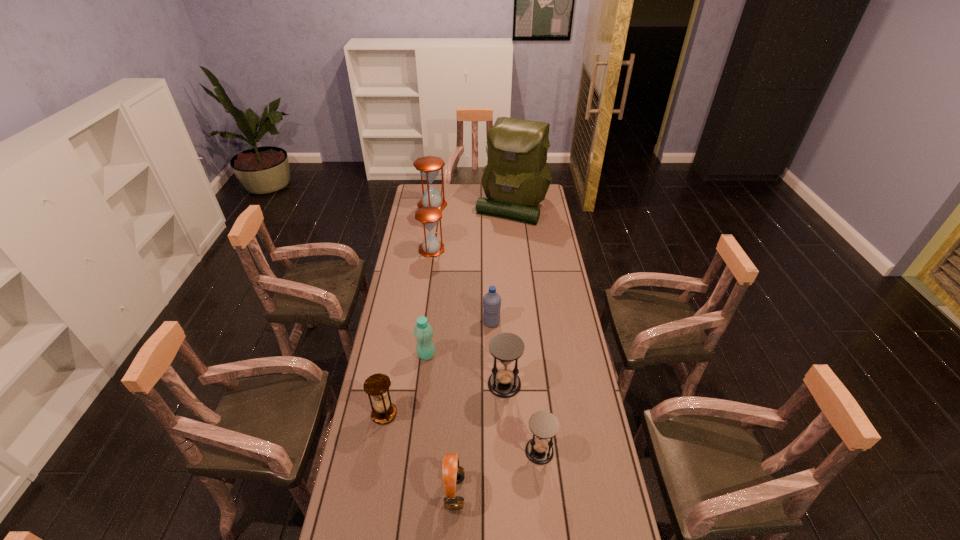
Locate which brown hourglass ranks third in proximity to the fifth nearest object. Please provide its 2D coordinates. Your answer should be formatted as a tuple, i.e. [(x, y)], where the tuple contains the x and y coordinates of a point satisfying the conditions above.

[(429, 166)]

This screenshot has width=960, height=540. I want to click on free space that satisfies the following two spatial constraints: 1. on the front side of the second nearest object; 2. on the right side of the fourth nearest object, so click(508, 451).

Where is `vacant space that satisfies the following two spatial constraints: 1. on the front side of the smaller black hourglass; 2. on the right side of the seventh farthest object`? The image size is (960, 540). vacant space that satisfies the following two spatial constraints: 1. on the front side of the smaller black hourglass; 2. on the right side of the seventh farthest object is located at coordinates (377, 451).

The width and height of the screenshot is (960, 540). I want to click on vacant space that satisfies the following two spatial constraints: 1. on the front side of the sixth nearest object; 2. on the right side of the second farthest brown hourglass, so click(421, 322).